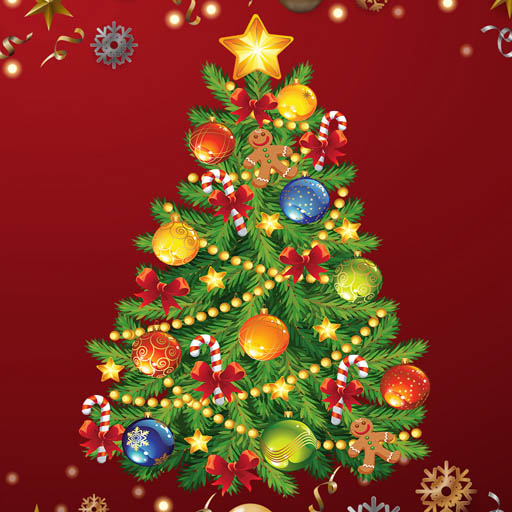
Find the location of a particular element. The image size is (512, 512). green ornament is located at coordinates (291, 451).